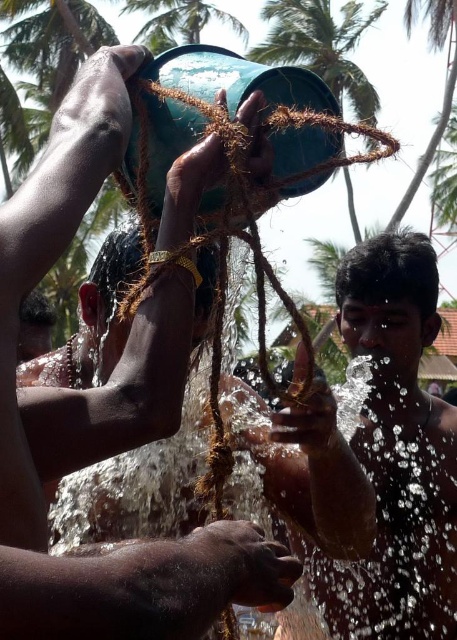
Question: Based on their relative distances, which object is nearer to the green leafy palm tree at upper center?

Choices:
 (A) matte green bucket at upper center
 (B) green matte palm tree at upper center

Answer: (B)

Question: Where is glossy brown hair at center located in relation to green leafy palm tree at upper center in the image?

Choices:
 (A) below
 (B) above

Answer: (A)

Question: Does matte green bucket at upper center appear on the left side of green leafy palm tree at upper center?

Choices:
 (A) no
 (B) yes

Answer: (A)

Question: Does glossy brown hair at center appear over green matte palm tree at upper center?

Choices:
 (A) yes
 (B) no

Answer: (B)

Question: Which object is farther from the camera taking this photo?

Choices:
 (A) matte green bucket at upper center
 (B) glossy brown hair at center
 (C) green leafy palm tree at upper center

Answer: (C)

Question: Which point is closer to the camera?

Choices:
 (A) green leafy palm tree at upper center
 (B) matte green bucket at upper center
 (C) glossy brown hair at center
 (D) green matte palm tree at upper center

Answer: (B)